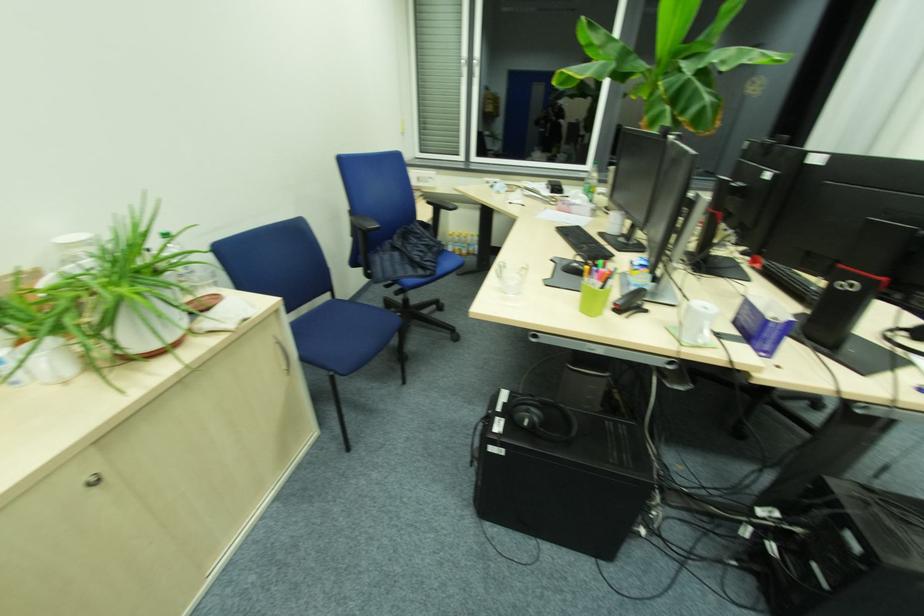
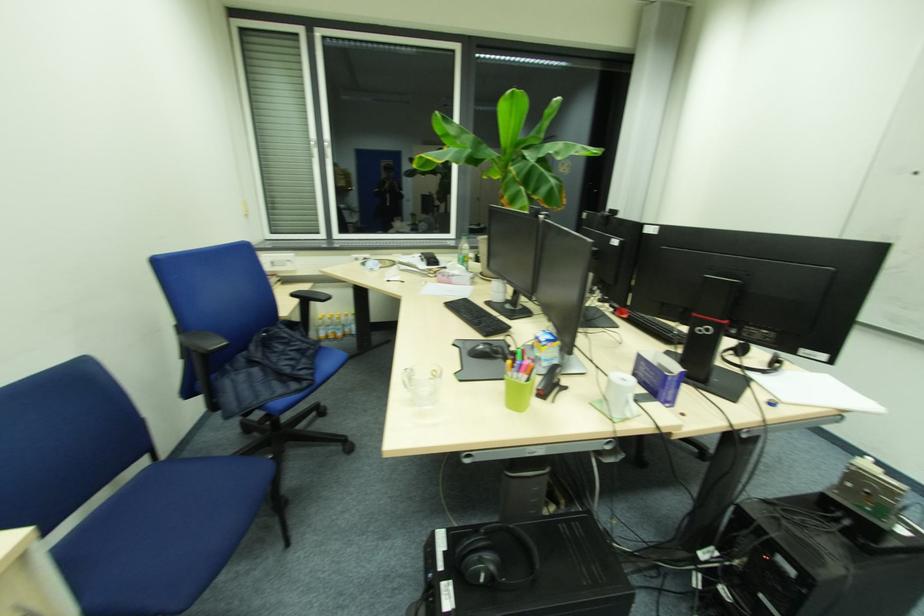
Question: The images are taken continuously from a first-person perspective. In which direction is your viewpoint rotating?

Choices:
 (A) Left
 (B) Right
 (C) Up
 (D) Down

Answer: (B)